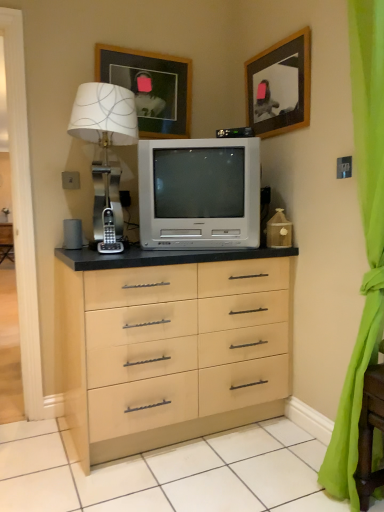
Question: Is green sheer curtain at right taller or shorter than metallic silver table lamp at left?

Choices:
 (A) short
 (B) tall

Answer: (B)

Question: Does point (354, 386) appear closer or farther from the camera than point (119, 214)?

Choices:
 (A) farther
 (B) closer

Answer: (B)

Question: Estimate the real-world distances between objects in this image. Which object is farther from the wooden framed picture at upper center, positioned as the first picture frame in left-to-right order?

Choices:
 (A) green sheer curtain at right
 (B) white plastic television at center
 (C) metallic silver table lamp at left
 (D) wooden picture frame at upper center, acting as the 2th picture frame starting from the left

Answer: (A)

Question: Estimate the real-world distances between objects in this image. Which object is farther from the wooden framed picture at upper center, positioned as the first picture frame in left-to-right order?

Choices:
 (A) metallic silver table lamp at left
 (B) green sheer curtain at right
 (C) wooden picture frame at upper center, acting as the 2th picture frame starting from the left
 (D) white plastic television at center

Answer: (B)